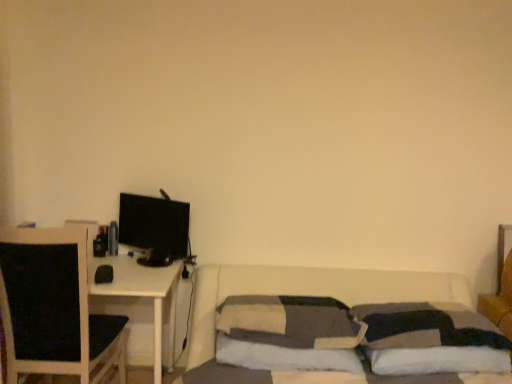
What is the approximate width of soft gray fabric pillow at center, positioned as the second pillow in right-to-left order?

soft gray fabric pillow at center, positioned as the second pillow in right-to-left order, is 36.65 centimeters wide.

You are a GUI agent. You are given a task and a screenshot of the screen. Output one action in this format:
    pyautogui.click(x=<x>, y=<y>)
    Task: Click on the white soft pillow at lower right, the third pillow when ordered from left to right
    
    Given the screenshot: What is the action you would take?
    pyautogui.click(x=431, y=339)

In order to click on black glossy monitor at left in this screenshot , I will do [154, 224].

You are a GUI agent. You are given a task and a screenshot of the screen. Output one action in this format:
    pyautogui.click(x=<x>, y=<y>)
    Task: Click on the black fabric chair at left
    This screenshot has height=384, width=512.
    Given the screenshot: What is the action you would take?
    pyautogui.click(x=53, y=306)

Describe the element at coordinates (290, 321) in the screenshot. I see `textured gray pillow at center, arranged as the 3th pillow when viewed from the right` at that location.

Identify the location of soft gray fabric pillow at center, positioned as the second pillow in left-to-right order. (284, 357).

Which object is closer to the camera, white soft pillow at lower right, acting as the 1th pillow starting from the right, or soft gray fabric pillow at center, positioned as the second pillow in right-to-left order?

white soft pillow at lower right, acting as the 1th pillow starting from the right.

Considering the sizes of white soft pillow at lower right, acting as the 1th pillow starting from the right, and soft gray fabric pillow at center, positioned as the second pillow in right-to-left order, in the image, is white soft pillow at lower right, acting as the 1th pillow starting from the right, taller or shorter than soft gray fabric pillow at center, positioned as the second pillow in right-to-left order,?

white soft pillow at lower right, acting as the 1th pillow starting from the right, is shorter than soft gray fabric pillow at center, positioned as the second pillow in right-to-left order.

Is white soft pillow at lower right, acting as the 1th pillow starting from the right, aimed at soft gray fabric pillow at center, positioned as the second pillow in left-to-right order?

No.

Would you say soft gray fabric pillow at center, positioned as the second pillow in right-to-left order, is outside white soft pillow at lower right, acting as the 1th pillow starting from the right?

Yes, soft gray fabric pillow at center, positioned as the second pillow in right-to-left order, is outside of white soft pillow at lower right, acting as the 1th pillow starting from the right.

Is soft gray fabric pillow at center, positioned as the second pillow in right-to-left order, wider or thinner than white soft pillow at lower right, acting as the 1th pillow starting from the right?

Considering their sizes, soft gray fabric pillow at center, positioned as the second pillow in right-to-left order, looks broader than white soft pillow at lower right, acting as the 1th pillow starting from the right.

Is soft gray fabric pillow at center, positioned as the second pillow in left-to-right order, next to white soft pillow at lower right, acting as the 1th pillow starting from the right, and touching it?

There is a gap between soft gray fabric pillow at center, positioned as the second pillow in left-to-right order, and white soft pillow at lower right, acting as the 1th pillow starting from the right.

Does soft gray fabric pillow at center, positioned as the second pillow in right-to-left order, have a greater height compared to white soft pillow at lower right, acting as the 1th pillow starting from the right?

Indeed, soft gray fabric pillow at center, positioned as the second pillow in right-to-left order, has a greater height compared to white soft pillow at lower right, acting as the 1th pillow starting from the right.

Consider the image. Does black fabric chair at left lie in front of white soft pillow at lower right, acting as the 1th pillow starting from the right?

No, it is behind white soft pillow at lower right, acting as the 1th pillow starting from the right.

Is point (7, 313) behind point (384, 344)?

No, (7, 313) is closer to viewer.

Which of these two, black fabric chair at left or white soft pillow at lower right, acting as the 1th pillow starting from the right, is bigger?

black fabric chair at left is bigger.

Image resolution: width=512 pixels, height=384 pixels. I want to click on pillow that is the 3rd object to the right of the black fabric chair at left, starting at the anchor, so click(x=431, y=339).

Are black fabric chair at left and black glossy monitor at left making contact?

There is a gap between black fabric chair at left and black glossy monitor at left.

Which object is positioned more to the right, black fabric chair at left or black glossy monitor at left?

From the viewer's perspective, black glossy monitor at left appears more on the right side.

Between black fabric chair at left and black glossy monitor at left, which one has more height?

black fabric chair at left is taller.

There is a black fabric chair at left. Where is `computer monitor above it (from a real-world perspective)`? computer monitor above it (from a real-world perspective) is located at coordinates (154, 224).

From the picture: From the image's perspective, who appears lower, black glossy monitor at left or soft gray fabric pillow at center, positioned as the second pillow in right-to-left order?

soft gray fabric pillow at center, positioned as the second pillow in right-to-left order, is shown below in the image.

Which is closer to the camera, [133,207] or [322,361]?

Point [133,207] is farther from the camera than point [322,361].

Do you think black glossy monitor at left is within soft gray fabric pillow at center, positioned as the second pillow in left-to-right order, or outside of it?

black glossy monitor at left is located beyond the bounds of soft gray fabric pillow at center, positioned as the second pillow in left-to-right order.

Would you consider black glossy monitor at left to be distant from soft gray fabric pillow at center, positioned as the second pillow in right-to-left order?

Actually, black glossy monitor at left and soft gray fabric pillow at center, positioned as the second pillow in right-to-left order, are a little close together.

Considering the relative sizes of black glossy monitor at left and black fabric chair at left in the image provided, is black glossy monitor at left shorter than black fabric chair at left?

Correct, black glossy monitor at left is not as tall as black fabric chair at left.

Which object is thinner, black glossy monitor at left or black fabric chair at left?

black glossy monitor at left.

Is black glossy monitor at left at the right side of black fabric chair at left?

Yes.

From a real-world perspective, is black glossy monitor at left over black fabric chair at left?

Yes.

From the image's perspective, is black glossy monitor at left located above white soft pillow at lower right, the third pillow when ordered from left to right?

Yes, from the image's perspective, black glossy monitor at left is above white soft pillow at lower right, the third pillow when ordered from left to right.

Is black glossy monitor at left located outside white soft pillow at lower right, the third pillow when ordered from left to right?

black glossy monitor at left lies outside white soft pillow at lower right, the third pillow when ordered from left to right,'s area.

There is a black glossy monitor at left. Where is `the 2nd pillow below it (from a real-world perspective)`? Image resolution: width=512 pixels, height=384 pixels. the 2nd pillow below it (from a real-world perspective) is located at coordinates point(431,339).

Which pillow is the 1st one when counting from the left side of the white soft pillow at lower right, acting as the 1th pillow starting from the right? Please provide its 2D coordinates.

[(284, 357)]

In the image, there is a white soft pillow at lower right, the third pillow when ordered from left to right. Where is `pillow below it (from a real-world perspective)`? pillow below it (from a real-world perspective) is located at coordinates (284, 357).

When comparing their distances from white soft pillow at lower right, the third pillow when ordered from left to right, does soft gray fabric pillow at center, positioned as the second pillow in right-to-left order, or textured gray pillow at center, the 1th pillow in the left-to-right sequence, seem further?

Based on the image, soft gray fabric pillow at center, positioned as the second pillow in right-to-left order, appears to be further to white soft pillow at lower right, the third pillow when ordered from left to right.

Considering their positions, is soft gray fabric pillow at center, positioned as the second pillow in left-to-right order, positioned closer to black fabric chair at left than textured gray pillow at center, arranged as the 3th pillow when viewed from the right?

soft gray fabric pillow at center, positioned as the second pillow in left-to-right order, is positioned closer to the anchor black fabric chair at left.

Based on their spatial positions, is white soft pillow at lower right, acting as the 1th pillow starting from the right, or soft gray fabric pillow at center, positioned as the second pillow in left-to-right order, closer to black glossy monitor at left?

The object closer to black glossy monitor at left is soft gray fabric pillow at center, positioned as the second pillow in left-to-right order.

From the image, which object appears to be farther from black fabric chair at left, black glossy monitor at left or textured gray pillow at center, the 1th pillow in the left-to-right sequence?

Based on the image, textured gray pillow at center, the 1th pillow in the left-to-right sequence, appears to be further to black fabric chair at left.

Looking at the image, which one is located further to soft gray fabric pillow at center, positioned as the second pillow in right-to-left order, black fabric chair at left or black glossy monitor at left?

Among the two, black fabric chair at left is located further to soft gray fabric pillow at center, positioned as the second pillow in right-to-left order.

Estimate the real-world distances between objects in this image. Which object is further from textured gray pillow at center, arranged as the 3th pillow when viewed from the right, soft gray fabric pillow at center, positioned as the second pillow in left-to-right order, or black fabric chair at left?

Among the two, black fabric chair at left is located further to textured gray pillow at center, arranged as the 3th pillow when viewed from the right.

When comparing their distances from black fabric chair at left, does black glossy monitor at left or white soft pillow at lower right, the third pillow when ordered from left to right, seem further?

The object further to black fabric chair at left is white soft pillow at lower right, the third pillow when ordered from left to right.

From the image, which object appears to be farther from textured gray pillow at center, the 1th pillow in the left-to-right sequence, white soft pillow at lower right, acting as the 1th pillow starting from the right, or black glossy monitor at left?

black glossy monitor at left is positioned further to the anchor textured gray pillow at center, the 1th pillow in the left-to-right sequence.

You are a GUI agent. You are given a task and a screenshot of the screen. Output one action in this format:
    pyautogui.click(x=<x>, y=<y>)
    Task: Click on the pillow situated between black glossy monitor at left and soft gray fabric pillow at center, positioned as the second pillow in right-to-left order, from left to right
    The width and height of the screenshot is (512, 384).
    Given the screenshot: What is the action you would take?
    pyautogui.click(x=290, y=321)

The width and height of the screenshot is (512, 384). Find the location of `pillow between black fabric chair at left and soft gray fabric pillow at center, positioned as the second pillow in right-to-left order`. pillow between black fabric chair at left and soft gray fabric pillow at center, positioned as the second pillow in right-to-left order is located at coordinates (290, 321).

I want to click on pillow between textured gray pillow at center, arranged as the 3th pillow when viewed from the right, and white soft pillow at lower right, the third pillow when ordered from left to right, from left to right, so click(284, 357).

Locate an element on the screen. computer monitor situated between black fabric chair at left and white soft pillow at lower right, acting as the 1th pillow starting from the right, from left to right is located at coordinates (154, 224).